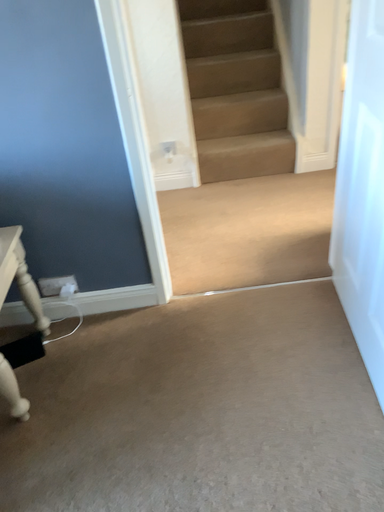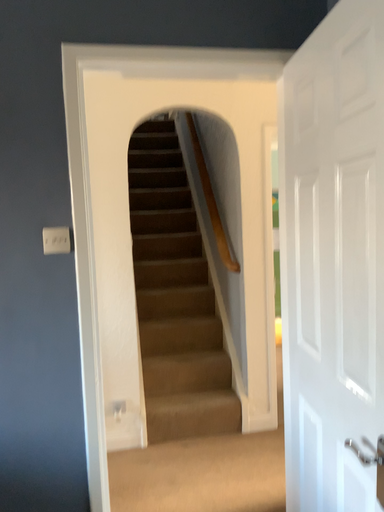
Question: How did the camera likely rotate when shooting the video?

Choices:
 (A) rotated right
 (B) rotated left

Answer: (A)